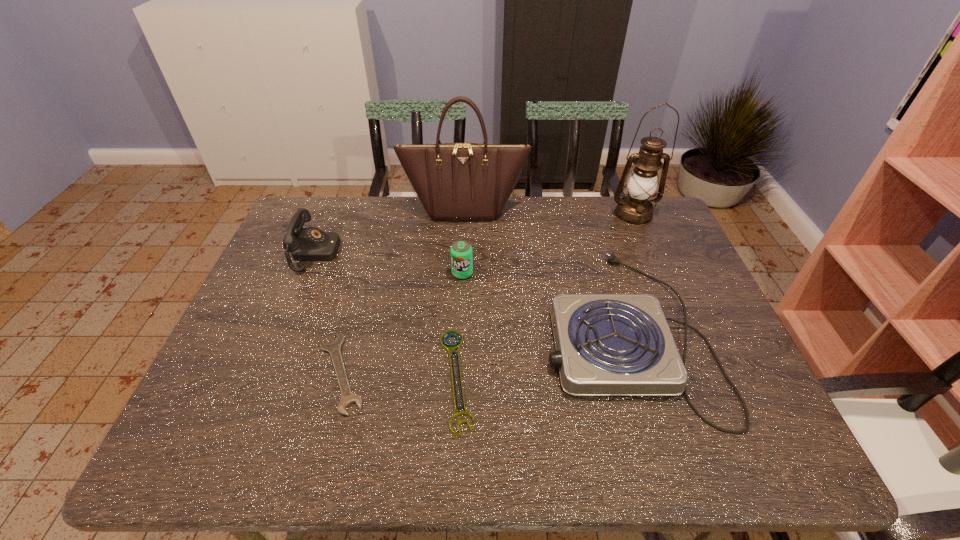
I want to click on handbag, so click(x=454, y=181).

Where is `oil lamp`? This screenshot has height=540, width=960. oil lamp is located at coordinates (635, 209).

Identify the location of the leftmost object. click(x=309, y=244).

This screenshot has height=540, width=960. I want to click on pop soda, so click(461, 251).

Locate an element on the screen. The width and height of the screenshot is (960, 540). hotplate is located at coordinates (606, 344).

I want to click on the left wrench, so click(334, 348).

Identify the location of the right wrench. (448, 347).

Where is `vacant area situated 0.070m on the front-facing side of the handbag`? vacant area situated 0.070m on the front-facing side of the handbag is located at coordinates (464, 236).

In order to click on free spot located 0.050m on the back of the oil lamp in this screenshot , I will do pos(625,195).

I want to click on blank space located on the dial of the leftmost object, so click(x=456, y=253).